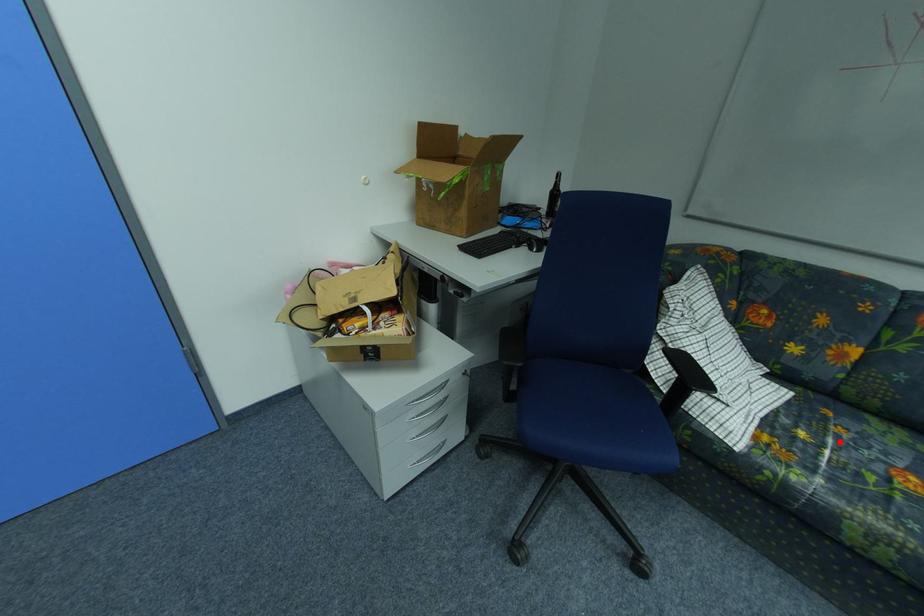
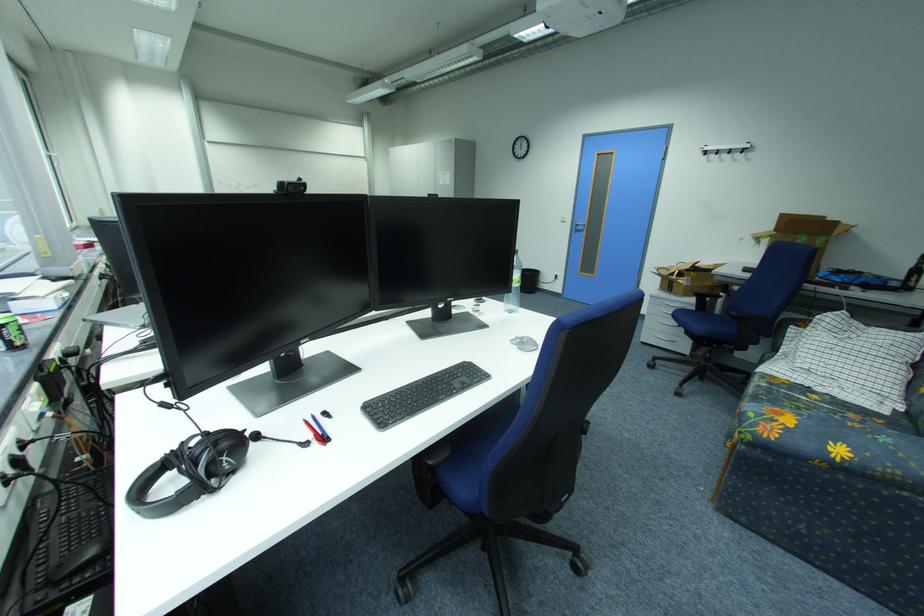
Question: I am providing you with two images of the same scene from different viewpoints. A red point is marked on the first image. At the location where the point appears in image 1, is it still visible in image 2?

Choices:
 (A) Yes
 (B) No

Answer: (A)